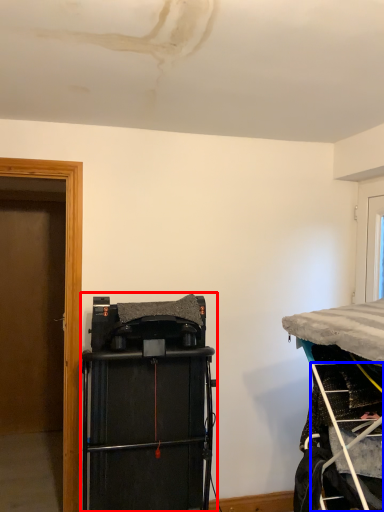
Question: Which object is further to the camera taking this photo, equipment (highlighted by a red box) or ladder (highlighted by a blue box)?

Choices:
 (A) equipment
 (B) ladder

Answer: (A)